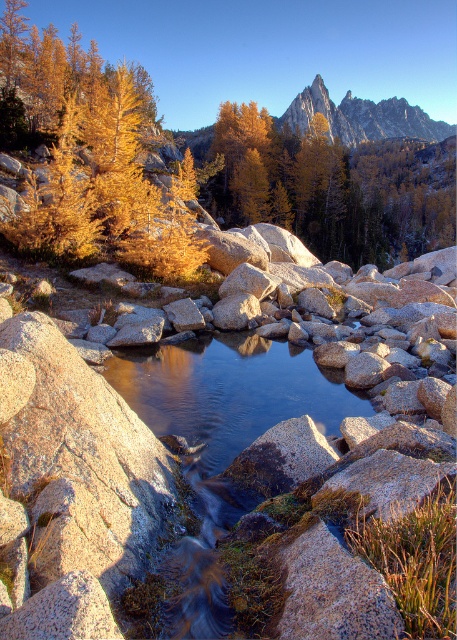
You are planning a hiking route and need to determine the distance between the golden larch tree at upper left and the sharp granite peak at upper center. Which object would you measure from first if you want to start at the base of the mountain?

You should start measuring from the golden larch tree at upper left since it is smaller in size compared to the sharp granite peak at upper center, making it closer to the base of the mountain.